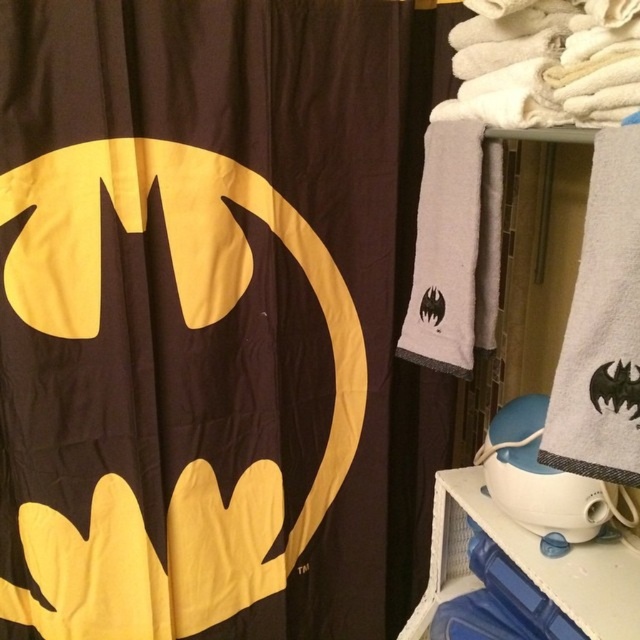
Question: Observing the image, what is the correct spatial positioning of matte black fabric batman logo at left in reference to white plastic shelf at lower right?

Choices:
 (A) right
 (B) left

Answer: (B)

Question: Considering the relative positions of matte black fabric batman logo at left and white plastic shelf at lower right in the image provided, where is matte black fabric batman logo at left located with respect to white plastic shelf at lower right?

Choices:
 (A) above
 (B) below

Answer: (A)

Question: In this image, where is matte black fabric batman logo at left located relative to white plastic shelf at lower right?

Choices:
 (A) right
 (B) left

Answer: (B)

Question: Which object appears farthest from the camera in this image?

Choices:
 (A) matte black fabric batman logo at left
 (B) white plastic shelf at lower right

Answer: (A)

Question: Which point appears farthest from the camera in this image?

Choices:
 (A) (461, 502)
 (B) (321, 134)

Answer: (B)